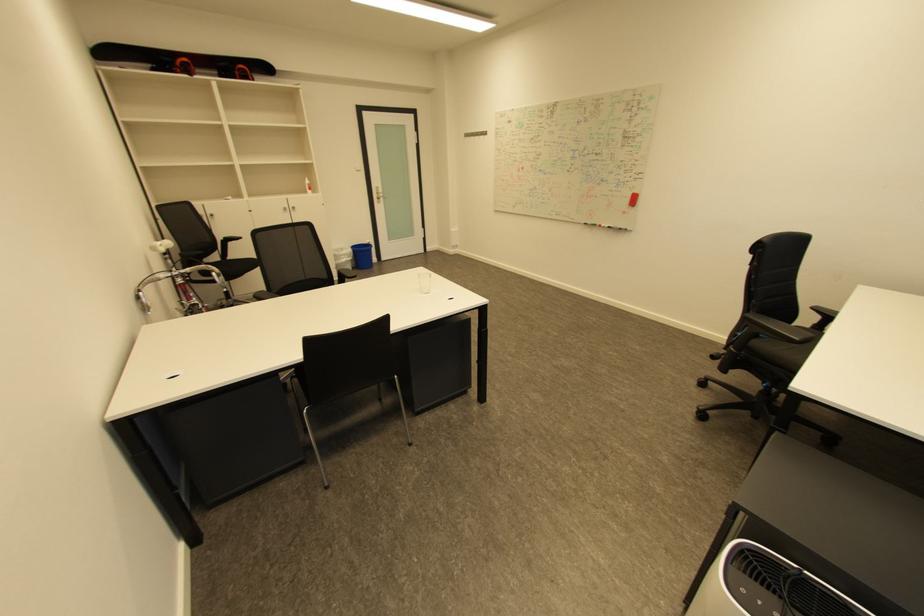
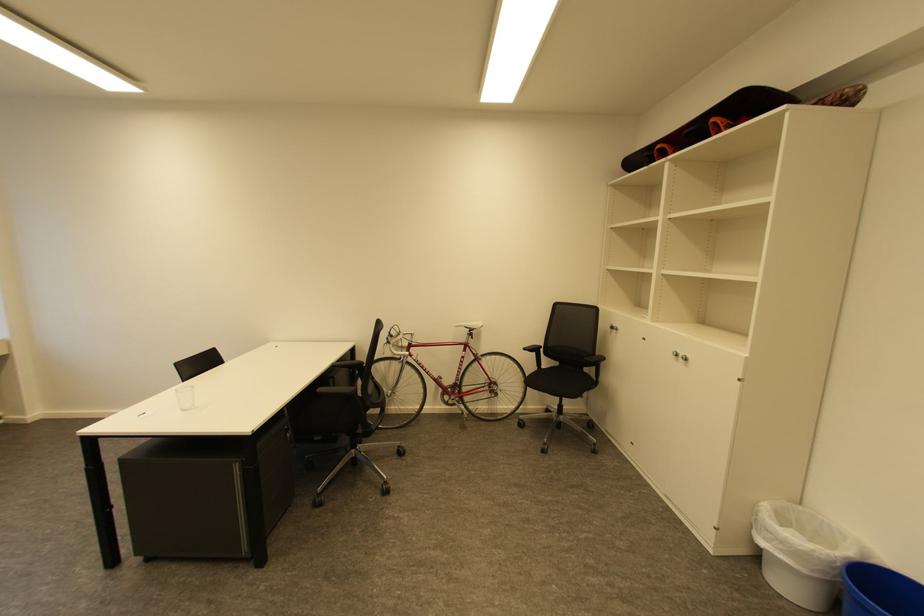
Where in the second image is the point corresponding to (349,256) from the first image?

(775, 533)